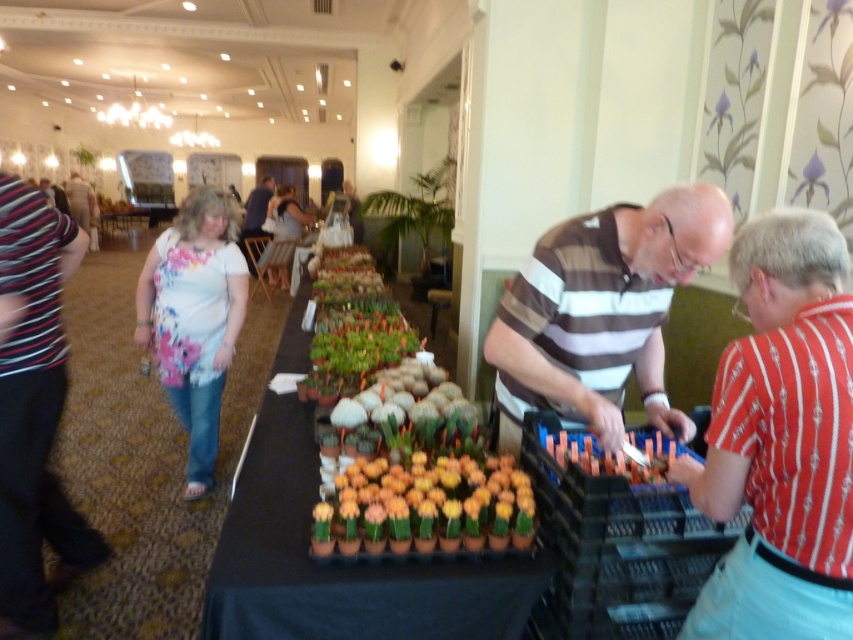
Locate an element on the screen. yellow-green succulent at center is located at coordinates (425, 508).

Is yellow-green succulent at center shorter than matte floral shirt at upper left?

Correct, yellow-green succulent at center is not as tall as matte floral shirt at upper left.

Does point (428, 484) come closer to viewer compared to point (68, 186)?

That is True.

This screenshot has width=853, height=640. Identify the location of yellow-green succulent at center. (425, 508).

Between green matte succulents at center and floral fabric blouse at center, which one has less height?

With less height is green matte succulents at center.

Who is more forward, (277, 536) or (187, 337)?

Point (277, 536) is in front.

Image resolution: width=853 pixels, height=640 pixels. Identify the location of green matte succulents at center. (340, 563).

This screenshot has width=853, height=640. Find the location of `green matte succulents at center`. green matte succulents at center is located at coordinates (340, 563).

Does red striped shirt at right have a lesser width compared to brown striped shirt at center?

Correct, red striped shirt at right's width is less than brown striped shirt at center's.

Is red striped shirt at right to the right of brown striped shirt at center from the viewer's perspective?

Correct, you'll find red striped shirt at right to the right of brown striped shirt at center.

What do you see at coordinates (781, 440) in the screenshot? The height and width of the screenshot is (640, 853). I see `red striped shirt at right` at bounding box center [781, 440].

The width and height of the screenshot is (853, 640). Identify the location of red striped shirt at right. (781, 440).